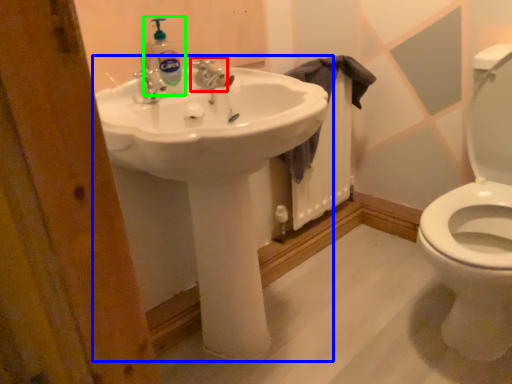
Question: Which is farther away from tap (highlighted by a red box)? sink (highlighted by a blue box) or cleaning product (highlighted by a green box)?

Choices:
 (A) sink
 (B) cleaning product

Answer: (A)